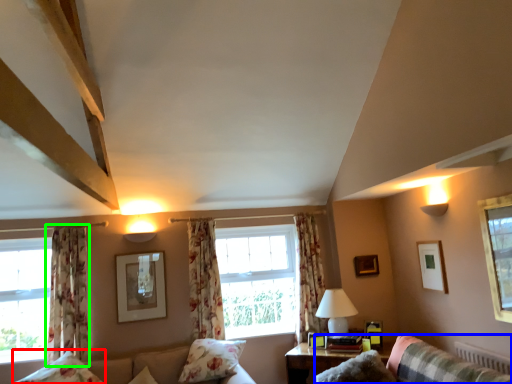
Question: Based on their relative distances, which object is farther from pillow (highlighted by a red box)? Choose from couch (highlighted by a blue box) and curtain (highlighted by a green box).

Choices:
 (A) couch
 (B) curtain

Answer: (A)